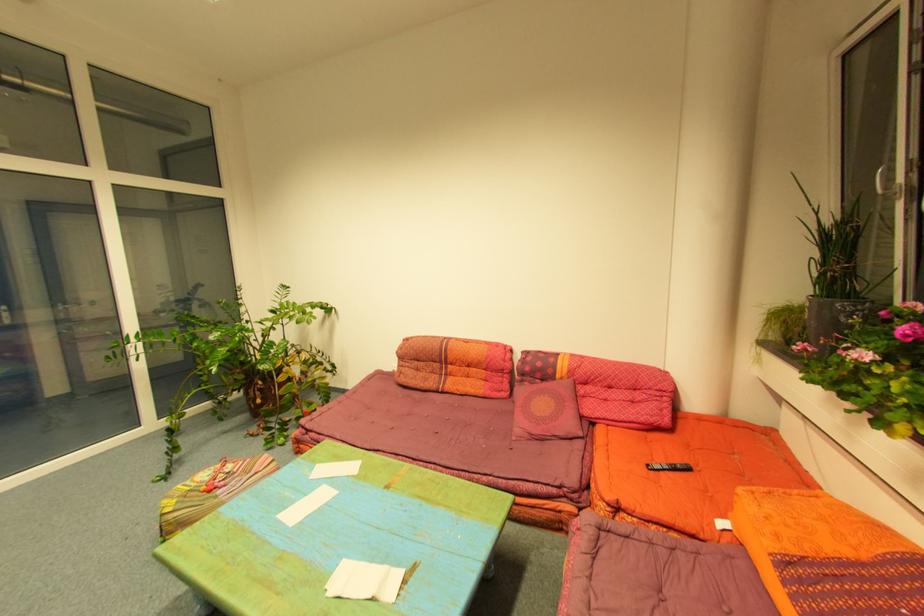
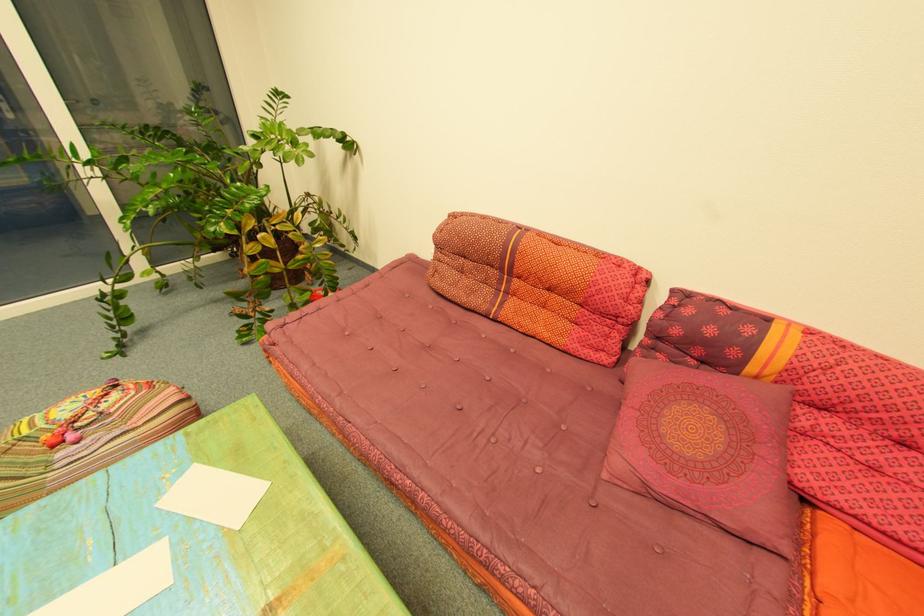
Question: What movement of the cameraman would produce the second image?

Choices:
 (A) Left
 (B) Right
 (C) Forward
 (D) Backward

Answer: (C)